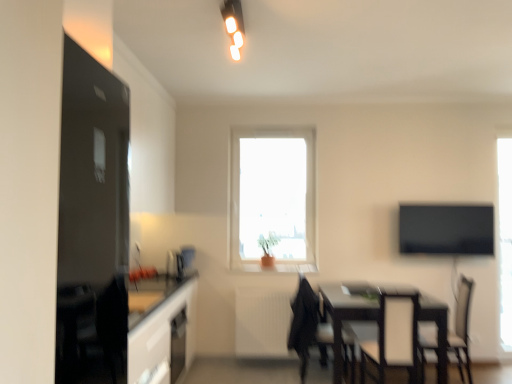
Question: From a real-world perspective, is transparent glass window at right, the second window positioned from the left, physically below dark wood table at lower right?

Choices:
 (A) yes
 (B) no

Answer: (B)

Question: Is there a large distance between transparent glass window at right, the second window positioned from the left, and dark wood table at lower right?

Choices:
 (A) no
 (B) yes

Answer: (B)

Question: Is transparent glass window at right, which is the first window from right to left, taller than dark wood table at lower right?

Choices:
 (A) no
 (B) yes

Answer: (B)

Question: From a real-world perspective, is transparent glass window at right, which is the first window from right to left, positioned over dark wood table at lower right based on gravity?

Choices:
 (A) no
 (B) yes

Answer: (B)

Question: Is transparent glass window at right, the second window positioned from the left, facing away from dark wood table at lower right?

Choices:
 (A) yes
 (B) no

Answer: (B)

Question: Is transparent glass window at right, the second window positioned from the left, outside of dark wood table at lower right?

Choices:
 (A) no
 (B) yes

Answer: (B)

Question: Can you confirm if black fabric chair at lower right, the 1th chair positioned from the right, is shorter than white textured radiator at center?

Choices:
 (A) yes
 (B) no

Answer: (B)

Question: Is black fabric chair at lower right, the 1th chair positioned from the right, to the right of white textured radiator at center from the viewer's perspective?

Choices:
 (A) no
 (B) yes

Answer: (B)

Question: From the image's perspective, does black fabric chair at lower right, the 1th chair positioned from the right, appear lower than white textured radiator at center?

Choices:
 (A) yes
 (B) no

Answer: (B)

Question: Can you confirm if black fabric chair at lower right, the 1th chair positioned from the right, is smaller than white textured radiator at center?

Choices:
 (A) yes
 (B) no

Answer: (B)

Question: Is black fabric chair at lower right, the 1th chair positioned from the right, aimed at white textured radiator at center?

Choices:
 (A) no
 (B) yes

Answer: (B)

Question: Is black fabric chair at lower right, the second chair positioned from the left, positioned with its back to white textured radiator at center?

Choices:
 (A) no
 (B) yes

Answer: (A)

Question: Can black leather chair at center, the 2th chair from the right, be found inside black fabric chair at lower right, the 1th chair positioned from the right?

Choices:
 (A) no
 (B) yes

Answer: (A)